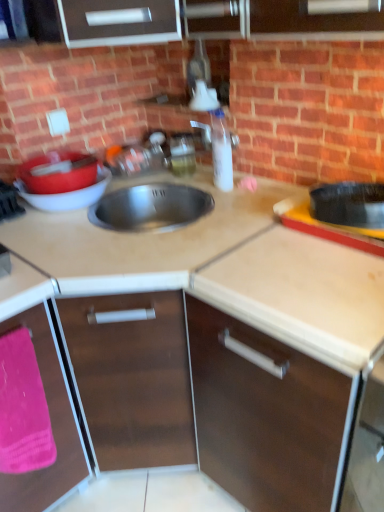
Question: Does pink fabric at lower left touch brown matte cabinet at lower left, the 2th cabinetry positioned from the right?

Choices:
 (A) no
 (B) yes

Answer: (B)

Question: From the image's perspective, is pink fabric at lower left located above brown matte cabinet at lower left, the 1th cabinetry when ordered from left to right?

Choices:
 (A) no
 (B) yes

Answer: (B)

Question: Is pink fabric at lower left not near brown matte cabinet at lower left, the 2th cabinetry positioned from the right?

Choices:
 (A) yes
 (B) no

Answer: (B)

Question: Is pink fabric at lower left not inside brown matte cabinet at lower left, the 2th cabinetry positioned from the right?

Choices:
 (A) no
 (B) yes

Answer: (A)

Question: From the image's perspective, is pink fabric at lower left beneath brown matte cabinet at lower left, the 2th cabinetry positioned from the right?

Choices:
 (A) yes
 (B) no

Answer: (B)

Question: From a real-world perspective, is satin steel sink at center, which is the 2th countertop from bottom to top, positioned above or below clear plastic bottle at center?

Choices:
 (A) below
 (B) above

Answer: (A)

Question: From their relative heights in the image, would you say satin steel sink at center, the 1th countertop from the top, is taller or shorter than clear plastic bottle at center?

Choices:
 (A) tall
 (B) short

Answer: (B)

Question: Choose the correct answer: Is satin steel sink at center, which is the 2th countertop from bottom to top, inside clear plastic bottle at center or outside it?

Choices:
 (A) outside
 (B) inside

Answer: (A)

Question: Is satin steel sink at center, which is the 2th countertop from bottom to top, to the left or to the right of clear plastic bottle at center in the image?

Choices:
 (A) right
 (B) left

Answer: (B)

Question: Considering the relative positions of matte red basin at left and translucent plastic soap dispenser at upper center in the image provided, is matte red basin at left to the left or to the right of translucent plastic soap dispenser at upper center?

Choices:
 (A) right
 (B) left

Answer: (B)

Question: From a real-world perspective, is matte red basin at left positioned above or below translucent plastic soap dispenser at upper center?

Choices:
 (A) above
 (B) below

Answer: (A)

Question: Is matte red basin at left in front of or behind translucent plastic soap dispenser at upper center in the image?

Choices:
 (A) front
 (B) behind

Answer: (A)

Question: From the image's perspective, is matte red basin at left above or below translucent plastic soap dispenser at upper center?

Choices:
 (A) above
 (B) below

Answer: (B)

Question: From the image's perspective, is matte red basin at left positioned above or below brown matte cabinet at lower left, the 1th cabinetry when ordered from left to right?

Choices:
 (A) below
 (B) above

Answer: (B)

Question: In terms of width, does matte red basin at left look wider or thinner when compared to brown matte cabinet at lower left, the 2th cabinetry positioned from the right?

Choices:
 (A) thin
 (B) wide

Answer: (A)